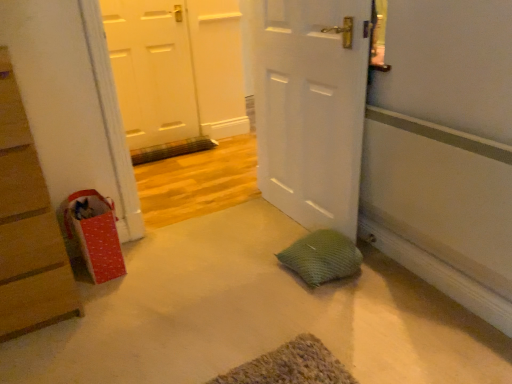
What is the approximate height of wooden vent at center?

The height of wooden vent at center is 14.14 centimeters.

Where is `red dotted paper bag at left`? red dotted paper bag at left is located at coordinates (95, 234).

This screenshot has width=512, height=384. What do you see at coordinates (152, 70) in the screenshot?
I see `white matte door at upper left, which is counted as the second door, starting from the right` at bounding box center [152, 70].

What is the approximate width of green mesh pillow at center?

The width of green mesh pillow at center is 11.84 inches.

The width and height of the screenshot is (512, 384). Identify the location of wooden vent at center. (170, 150).

Consider the image. Does red cardboard chest of drawers at left touch green mesh pillow at center?

No.

Is point (62, 273) less distant than point (280, 262)?

That is True.

Considering the sizes of objects red cardboard chest of drawers at left and green mesh pillow at center in the image provided, who is wider, red cardboard chest of drawers at left or green mesh pillow at center?

Wider between the two is red cardboard chest of drawers at left.

Where is `pillow located on the right of red cardboard chest of drawers at left`? pillow located on the right of red cardboard chest of drawers at left is located at coordinates (322, 257).

Considering the sizes of wooden vent at center and white matte door at center, which appears as the 2th door when viewed from the left, in the image, is wooden vent at center taller or shorter than white matte door at center, which appears as the 2th door when viewed from the left,?

Clearly, wooden vent at center is shorter compared to white matte door at center, which appears as the 2th door when viewed from the left.

From a real-world perspective, who is located higher, wooden vent at center or white matte door at center, which appears as the 2th door when viewed from the left?

white matte door at center, which appears as the 2th door when viewed from the left, is physically above.

Is point (190, 145) closer to viewer compared to point (256, 127)?

No, (190, 145) is further to viewer.

Is wooden vent at center closer to the viewer compared to white matte door at center, which appears as the 2th door when viewed from the back?

No, wooden vent at center is further to the viewer.

Who is bigger, white matte door at upper left, the second door viewed from the front, or red dotted paper bag at left?

With larger size is white matte door at upper left, the second door viewed from the front.

Which door is the 1st one when counting from the right side of the red dotted paper bag at left? Please provide its 2D coordinates.

[(152, 70)]

Looking at this image, from a real-world perspective, is white matte door at upper left, which is counted as the second door, starting from the right, positioned above or below red dotted paper bag at left?

In terms of real-world spatial position, white matte door at upper left, which is counted as the second door, starting from the right, is above red dotted paper bag at left.

Which point is more distant from viewer, (172, 13) or (82, 210)?

Point (172, 13)

From the image's perspective, is red dotted paper bag at left on top of wooden vent at center?

Incorrect, from the image's perspective, red dotted paper bag at left is lower than wooden vent at center.

Would you say red dotted paper bag at left is outside wooden vent at center?

red dotted paper bag at left is positioned outside wooden vent at center.

Does red dotted paper bag at left have a larger size compared to wooden vent at center?

Correct, red dotted paper bag at left is larger in size than wooden vent at center.

Could you tell me if red dotted paper bag at left is facing wooden vent at center?

No, red dotted paper bag at left is not facing towards wooden vent at center.

Is green mesh pillow at center situated inside red dotted paper bag at left or outside?

The correct answer is: outside.

From the image's perspective, between green mesh pillow at center and red dotted paper bag at left, who is located below?

From the image's view, green mesh pillow at center is below.

Considering the sizes of green mesh pillow at center and red dotted paper bag at left in the image, is green mesh pillow at center bigger or smaller than red dotted paper bag at left?

In the image, green mesh pillow at center appears to be smaller than red dotted paper bag at left.

Does red cardboard chest of drawers at left have a greater width compared to white matte door at center, which appears as the 2th door when viewed from the left?

Indeed, red cardboard chest of drawers at left has a greater width compared to white matte door at center, which appears as the 2th door when viewed from the left.

Would you say red cardboard chest of drawers at left is a long distance from white matte door at center, which appears as the 2th door when viewed from the left?

red cardboard chest of drawers at left is positioned a significant distance from white matte door at center, which appears as the 2th door when viewed from the left.

This screenshot has height=384, width=512. Find the location of `chest of drawers below the white matte door at center, the first door in the front-to-back sequence (from the image's perspective)`. chest of drawers below the white matte door at center, the first door in the front-to-back sequence (from the image's perspective) is located at coordinates (28, 227).

Which is more distant, (7, 75) or (277, 0)?

The point (277, 0) is farther.

Which is correct: white matte door at center, which appears as the 2th door when viewed from the left, is inside red dotted paper bag at left, or outside of it?

white matte door at center, which appears as the 2th door when viewed from the left, is spatially situated outside red dotted paper bag at left.

Considering the positions of point (325, 135) and point (106, 209), is point (325, 135) closer or farther from the camera than point (106, 209)?

Point (325, 135).

Considering the sizes of white matte door at center, which appears as the 2th door when viewed from the back, and red dotted paper bag at left in the image, is white matte door at center, which appears as the 2th door when viewed from the back, taller or shorter than red dotted paper bag at left?

Clearly, white matte door at center, which appears as the 2th door when viewed from the back, is taller compared to red dotted paper bag at left.

Locate an element on the screen. pillow on the right of red cardboard chest of drawers at left is located at coordinates (322, 257).

Locate an element on the screen. This screenshot has width=512, height=384. bath mat that is behind the white matte door at center, which ranks as the 1th door in right-to-left order is located at coordinates (170, 150).

Which object lies nearer to the anchor point white matte door at upper left, acting as the first door starting from the back, red cardboard chest of drawers at left or green mesh pillow at center?

Based on the image, red cardboard chest of drawers at left appears to be nearer to white matte door at upper left, acting as the first door starting from the back.

Which object lies nearer to the anchor point green mesh pillow at center, white matte door at upper left, the second door viewed from the front, or red cardboard chest of drawers at left?

Among the two, red cardboard chest of drawers at left is located nearer to green mesh pillow at center.

Which object lies further to the anchor point white matte door at upper left, the first door from the left, green mesh pillow at center or white matte door at center, which ranks as the 1th door in right-to-left order?

green mesh pillow at center is positioned further to the anchor white matte door at upper left, the first door from the left.

When comparing their distances from red cardboard chest of drawers at left, does red dotted paper bag at left or wooden vent at center seem closer?

Based on the image, red dotted paper bag at left appears to be nearer to red cardboard chest of drawers at left.

When comparing their distances from red dotted paper bag at left, does wooden vent at center or green mesh pillow at center seem closer?

green mesh pillow at center.

From the picture: Based on their spatial positions, is white matte door at upper left, the first door from the left, or white matte door at center, which ranks as the 1th door in right-to-left order, closer to red dotted paper bag at left?

white matte door at center, which ranks as the 1th door in right-to-left order.

Estimate the real-world distances between objects in this image. Which object is further from wooden vent at center, red dotted paper bag at left or red cardboard chest of drawers at left?

red cardboard chest of drawers at left lies further to wooden vent at center than the other object.

From the picture: From the image, which object appears to be farther from red cardboard chest of drawers at left, white matte door at center, which ranks as the 1th door in right-to-left order, or red dotted paper bag at left?

Among the two, white matte door at center, which ranks as the 1th door in right-to-left order, is located further to red cardboard chest of drawers at left.

Image resolution: width=512 pixels, height=384 pixels. In order to click on pillow located between red cardboard chest of drawers at left and white matte door at upper left, the first door from the left, in the depth direction in this screenshot , I will do (322, 257).

Where is `shopping bag between red cardboard chest of drawers at left and white matte door at upper left, the second door viewed from the front, in the front-back direction`? shopping bag between red cardboard chest of drawers at left and white matte door at upper left, the second door viewed from the front, in the front-back direction is located at coordinates (95, 234).

Locate an element on the screen. Image resolution: width=512 pixels, height=384 pixels. shopping bag between white matte door at upper left, the first door from the left, and green mesh pillow at center vertically is located at coordinates (95, 234).

At what (x,y) coordinates should I click in order to perform the action: click on shopping bag between red cardboard chest of drawers at left and green mesh pillow at center. Please return your answer as a coordinate pair (x, y). The width and height of the screenshot is (512, 384). Looking at the image, I should click on (95, 234).